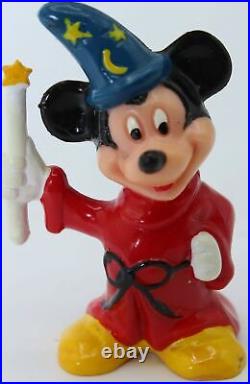
Locate an element on the screen. This screenshot has height=384, width=250. red robe is located at coordinates (191, 308).